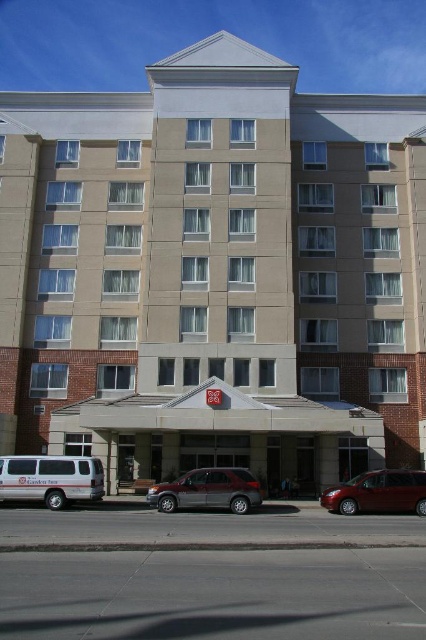
Question: Is the position of white van at lower left less distant than that of glossy metallic minivan at lower right?

Choices:
 (A) yes
 (B) no

Answer: (B)

Question: Which point is closer to the camera?

Choices:
 (A) click(408, 490)
 (B) click(161, 497)

Answer: (A)

Question: Does beige concrete building at center have a smaller size compared to white van at lower left?

Choices:
 (A) no
 (B) yes

Answer: (A)

Question: Which point is closer to the camera?

Choices:
 (A) beige concrete building at center
 (B) glossy metallic minivan at lower right
 (C) white van at lower left
 (D) silver metallic minivan at center

Answer: (B)

Question: Which point appears farthest from the camera in this image?

Choices:
 (A) (238, 490)
 (B) (31, 476)
 (C) (34, 195)
 (D) (367, 481)

Answer: (C)

Question: Is beige concrete building at center below glossy metallic minivan at lower right?

Choices:
 (A) no
 (B) yes

Answer: (A)